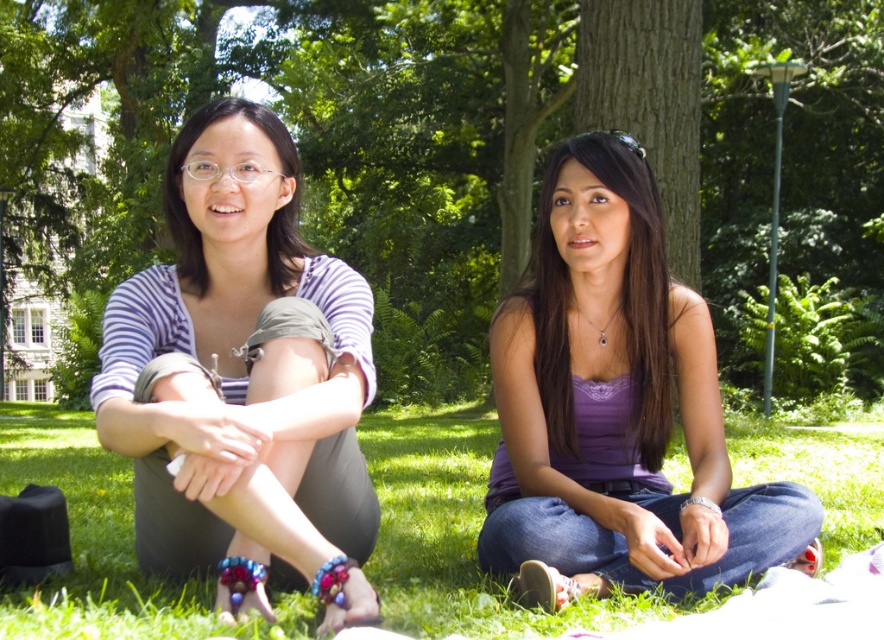
Which of these two, purple fabric tank top at center or matte purple blouse at left, stands taller?

Standing taller between the two is purple fabric tank top at center.

Does purple fabric tank top at center come behind matte purple blouse at left?

No, it is in front of matte purple blouse at left.

What do you see at coordinates (616, 408) in the screenshot? I see `purple fabric tank top at center` at bounding box center [616, 408].

Where is `purple fabric tank top at center`? purple fabric tank top at center is located at coordinates (616, 408).

Can you confirm if purple satin top at center is smaller than matte purple blouse at left?

Yes, purple satin top at center is smaller than matte purple blouse at left.

Is point (545, 273) farther from viewer compared to point (194, 120)?

Yes, it is behind point (194, 120).

Locate an element on the screen. This screenshot has width=884, height=640. purple satin top at center is located at coordinates (620, 298).

Who is lower down, striped fabric shirt at left or matte purple blouse at left?

Positioned lower is striped fabric shirt at left.

Where is `striped fabric shirt at left`? The image size is (884, 640). striped fabric shirt at left is located at coordinates (242, 380).

At what (x,y) coordinates should I click in order to perform the action: click on striped fabric shirt at left. Please return your answer as a coordinate pair (x, y). The height and width of the screenshot is (640, 884). Looking at the image, I should click on (242, 380).